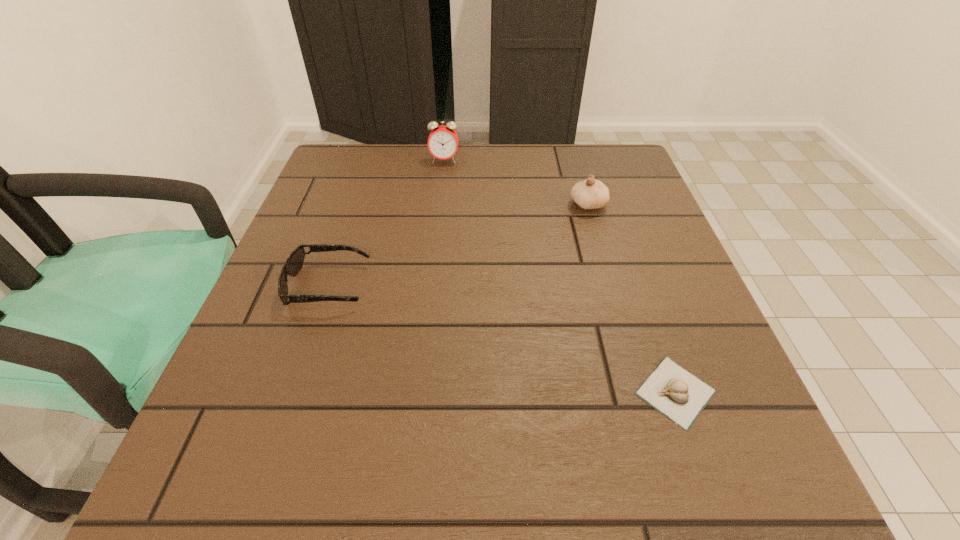
The image size is (960, 540). What are the coordinates of `the farthest object` in the screenshot? It's located at (443, 141).

The width and height of the screenshot is (960, 540). Find the location of `the third object from right to left`. the third object from right to left is located at coordinates (443, 141).

What are the coordinates of `the farther garlic` in the screenshot? It's located at (589, 194).

What are the coordinates of `the taller garlic` in the screenshot? It's located at (589, 194).

This screenshot has width=960, height=540. I want to click on the third tallest object, so (294, 263).

Identify the location of sunglasses. (294, 263).

Locate an element on the screen. The height and width of the screenshot is (540, 960). the shortest object is located at coordinates (678, 394).

This screenshot has height=540, width=960. What are the coordinates of `the nearest object` in the screenshot? It's located at (678, 394).

This screenshot has width=960, height=540. Identify the location of vacant space located on the front-facing side of the farthest object. (442, 190).

At what (x,y) coordinates should I click in order to perform the action: click on vacant space situated on the left of the second farthest object. Please return your answer as a coordinate pair (x, y). The image size is (960, 540). Looking at the image, I should click on 424,205.